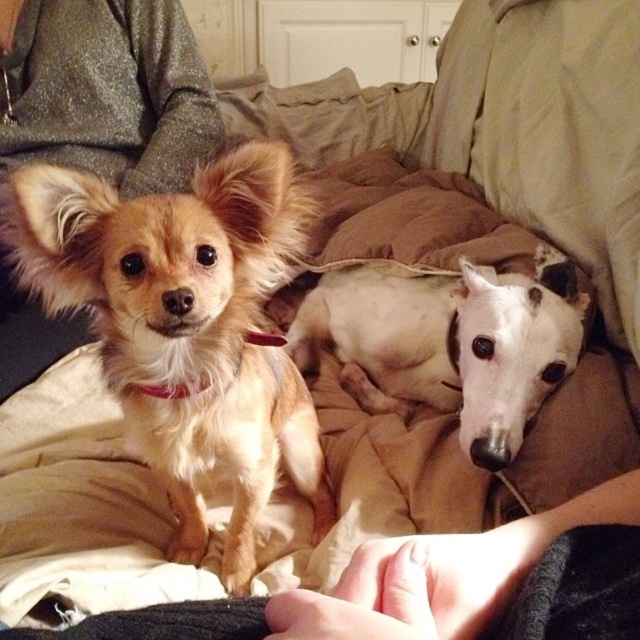
You are standing in the bedroom and want to place a small decorative item exactly halfway between point (x=93, y=304) and point (x=532, y=378). Will the item be closer to the bed or the wall?

The halfway point between point (x=93, y=304) and point (x=532, y=378) would be closer to the wall since point (x=532, y=378) is farther from the viewer compared to point (x=93, y=304).

You are trying to locate a specific point in the image. Which object is the point at coordinate [451,342] located on?

The point at coordinate [451,342] is located on the white smooth dog at center.

You are a photographer trying to capture both the fuzzy brown dog at left and the smooth skin hand at lower center in the same frame. Based on their sizes, which object would appear larger in the photo?

The fuzzy brown dog at left would appear larger in the photo because its width surpasses that of the smooth skin hand at lower center.